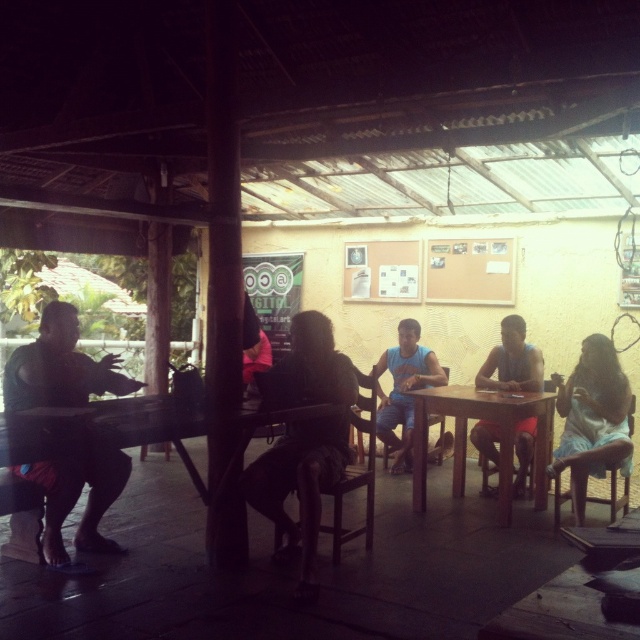
You are sitting at the wooden table at center and want to pass a napkin to someone wearing the matte black shirt at left. Considering the width of both objects, will the napkin fit in the space between them?

The matte black shirt at left has a lesser width compared to wooden table at center, so the napkin should easily fit between them as there is enough space.

Where is the matte blue tank top at center located in the image?

The matte blue tank top at center is located at point 0.564 on the x axis and 0.800 on the y axis.

You are standing at point (246, 317) and want to walk to the exit located at point (484, 388). Is there any obstruction between your current position and the exit?

Point (484, 388) is behind point (246, 317), so there is an obstruction between your current position and the exit.